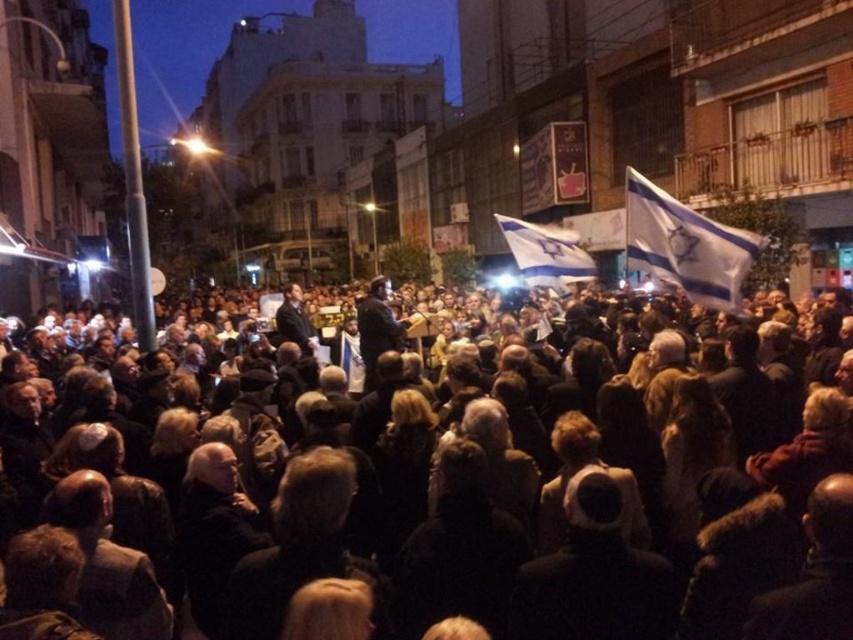
Question: Which point is closer to the camera?

Choices:
 (A) white fabric flag at center
 (B) white fabric flag at upper right

Answer: (B)

Question: Is black fabric crowd at center in front of white fabric flag at center?

Choices:
 (A) yes
 (B) no

Answer: (A)

Question: Estimate the real-world distances between objects in this image. Which object is farther from the black fabric crowd at center?

Choices:
 (A) white fabric flag at center
 (B) white fabric flag at upper right

Answer: (A)

Question: Does white fabric flag at upper right appear under white fabric flag at center?

Choices:
 (A) yes
 (B) no

Answer: (A)

Question: Can you confirm if black fabric crowd at center is positioned to the left of white fabric flag at upper right?

Choices:
 (A) no
 (B) yes

Answer: (B)

Question: Considering the real-world distances, which object is closest to the white fabric flag at upper right?

Choices:
 (A) white fabric flag at center
 (B) black fabric crowd at center

Answer: (A)